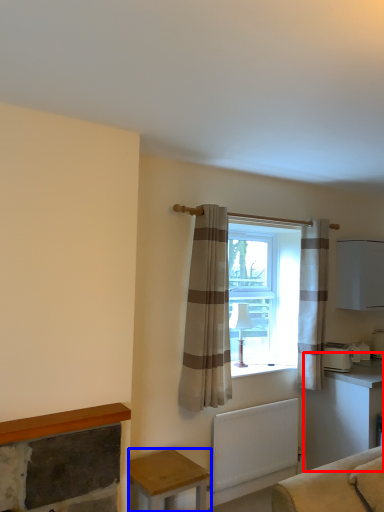
Question: Which of the following is the farthest to the observer, table (highlighted by a red box) or table (highlighted by a blue box)?

Choices:
 (A) table
 (B) table

Answer: (A)